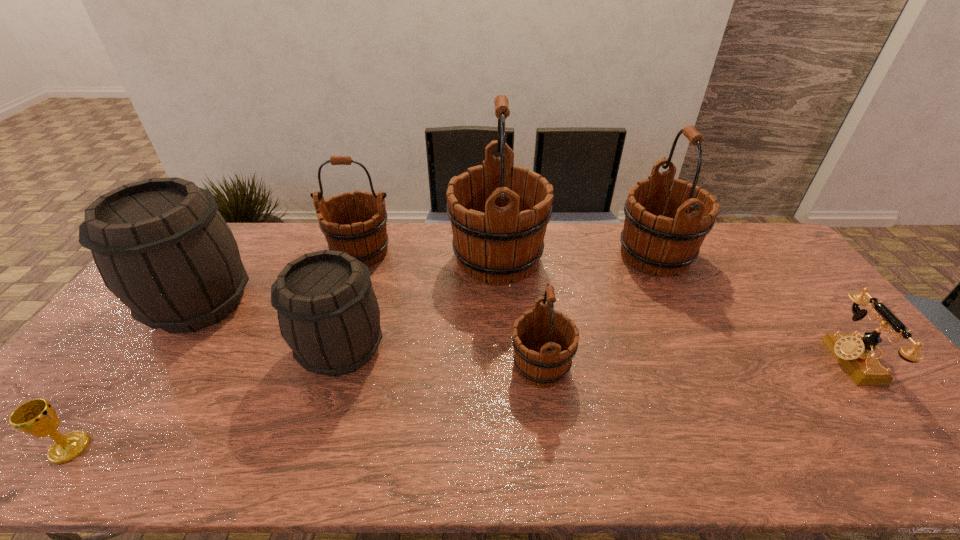
The width and height of the screenshot is (960, 540). What are the coordinates of `vacant space at the left edge of the desktop` in the screenshot? It's located at (134, 349).

In the image, there is a desktop. At what (x,y) coordinates should I click in order to perform the action: click on vacant space at the right edge. Please return your answer as a coordinate pair (x, y). Image resolution: width=960 pixels, height=540 pixels. Looking at the image, I should click on (837, 331).

Locate an element on the screen. The image size is (960, 540). vacant area at the near right corner of the desktop is located at coordinates (879, 441).

I want to click on free space between the second object from right to left and the telephone, so click(x=752, y=307).

Where is `vacant area between the rightmost object and the fifth shortest wine bucket`? The image size is (960, 540). vacant area between the rightmost object and the fifth shortest wine bucket is located at coordinates (752, 307).

This screenshot has width=960, height=540. I want to click on free spot between the right brown wine bucket and the nearest wood wine bucket, so click(x=442, y=357).

Where is `empty location between the right brown wine bucket and the nearest wood wine bucket`? empty location between the right brown wine bucket and the nearest wood wine bucket is located at coordinates (442, 357).

The width and height of the screenshot is (960, 540). In order to click on free space between the chalice and the right brown wine bucket in this screenshot , I will do `click(205, 398)`.

The width and height of the screenshot is (960, 540). In order to click on blank region between the right brown wine bucket and the second biggest wood wine bucket in this screenshot , I will do `click(498, 302)`.

You are a GUI agent. You are given a task and a screenshot of the screen. Output one action in this format:
    pyautogui.click(x=<x>, y=<y>)
    Task: Click on the seventh closest object to the smaller brown wine bucket
    The width and height of the screenshot is (960, 540).
    Given the screenshot: What is the action you would take?
    pyautogui.click(x=856, y=355)